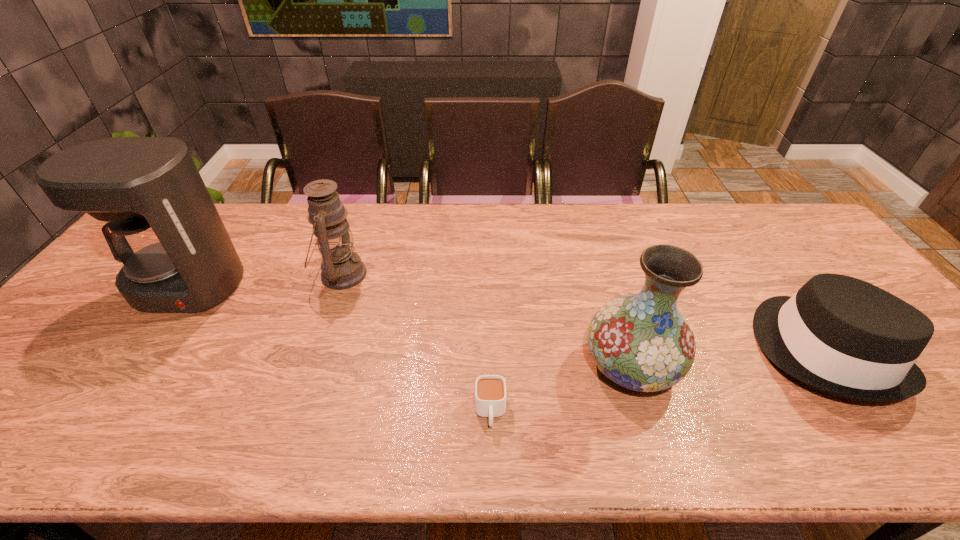
Locate an element on the screen. The image size is (960, 540). vacant position in the image that satisfies the following two spatial constraints: 1. on the button side of the leftmost object; 2. on the left side of the second shortest object is located at coordinates (143, 349).

Where is `free space that satisfies the following two spatial constraints: 1. on the button side of the tallest object; 2. on the left side of the fedora`? The width and height of the screenshot is (960, 540). free space that satisfies the following two spatial constraints: 1. on the button side of the tallest object; 2. on the left side of the fedora is located at coordinates (143, 349).

The height and width of the screenshot is (540, 960). I want to click on vacant space that satisfies the following two spatial constraints: 1. on the button side of the fedora; 2. on the right side of the coffee maker, so click(x=143, y=349).